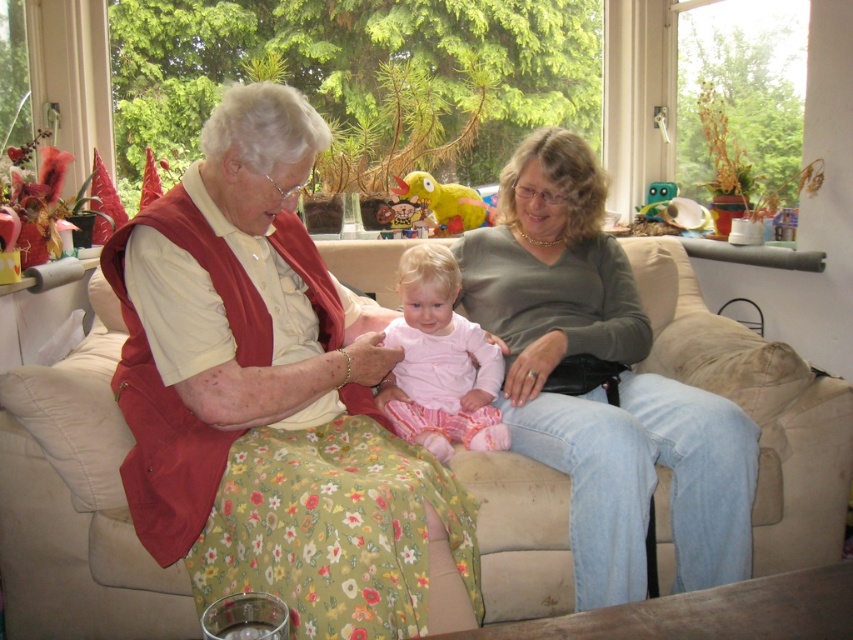
Does floral fabric dress at center appear on the left side of matte green sweater at center?

Correct, you'll find floral fabric dress at center to the left of matte green sweater at center.

Is point (363, 560) positioned before point (637, 508)?

Yes, point (363, 560) is in front of point (637, 508).

Where is `floral fabric dress at center`? The width and height of the screenshot is (853, 640). floral fabric dress at center is located at coordinates (270, 396).

At what (x,y) coordinates should I click in order to perform the action: click on floral fabric dress at center. Please return your answer as a coordinate pair (x, y). Looking at the image, I should click on (270, 396).

Is floral fabric dress at center below pink fabric baby at center?

Indeed, floral fabric dress at center is positioned under pink fabric baby at center.

How much distance is there between floral fabric dress at center and pink fabric baby at center?

floral fabric dress at center is 27.16 centimeters away from pink fabric baby at center.

Where is `floral fabric dress at center`? The height and width of the screenshot is (640, 853). floral fabric dress at center is located at coordinates (270, 396).

At what (x,y) coordinates should I click in order to perform the action: click on floral fabric dress at center. Please return your answer as a coordinate pair (x, y). This screenshot has width=853, height=640. Looking at the image, I should click on (270, 396).

Can you confirm if matte green sweater at center is positioned to the left of pink fabric baby at center?

No, matte green sweater at center is not to the left of pink fabric baby at center.

This screenshot has width=853, height=640. Identify the location of matte green sweater at center. (602, 381).